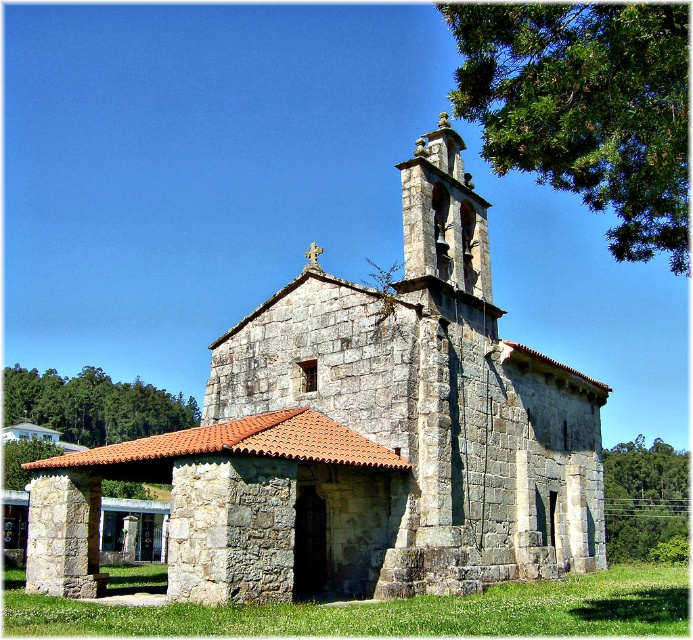
Is green leafy tree at upper right closer to the viewer compared to green leafy tree at right?

Yes, green leafy tree at upper right is in front of green leafy tree at right.

Describe the element at coordinates (586, 108) in the screenshot. I see `green leafy tree at upper right` at that location.

Locate an element on the screen. This screenshot has height=640, width=693. green leafy tree at upper right is located at coordinates (586, 108).

Is gray stone church at center below green leafy tree at upper left?

No, gray stone church at center is not below green leafy tree at upper left.

Is point (310, 524) positioned in front of point (37, 374)?

Yes.

Identify the location of gray stone church at center. (359, 436).

Is green leafy tree at upper right bigger than green leafy tree at upper left?

Yes.

Describe the element at coordinates (586, 108) in the screenshot. The width and height of the screenshot is (693, 640). I see `green leafy tree at upper right` at that location.

Locate an element on the screen. The height and width of the screenshot is (640, 693). green leafy tree at upper right is located at coordinates (586, 108).